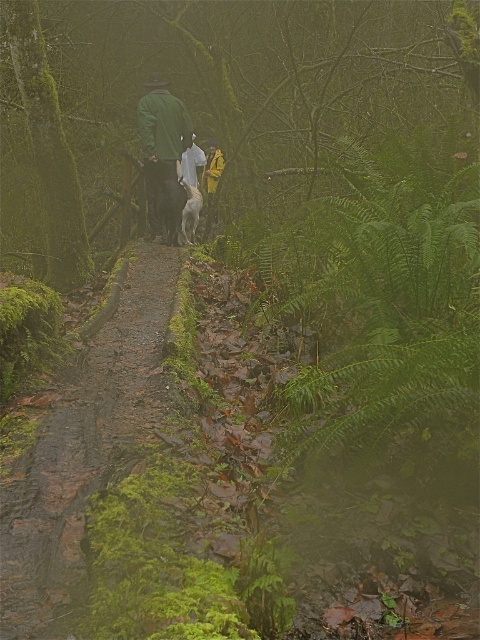
You are a hiker who wants to walk along the mossy dirt path at center while carrying the yellow waterproof jacket at center. Since the jacket is smaller than the path, can you walk on the path without the jacket touching the ground?

The mossy dirt path at center is bigger than the yellow waterproof jacket at center, so yes, you can walk on the path while carrying the jacket without it touching the ground.

You are standing on the path in the misty forest and see two points marked on the ground. The first point is at coordinates point [165,326] and the second point is at point [215,189]. If you want to walk towards the point that is closer to you, which coordinate should you head towards?

Point [165,326] is in front of point [215,189], so you should head towards point [165,326] since it is closer to your current position.

You are a hiker walking along the misty forest path. You see a white fur dog at center and a green wool jacket at center. Which object is positioned to the left when viewed from your perspective?

The white fur dog at center is positioned to the left of the green wool jacket at center.